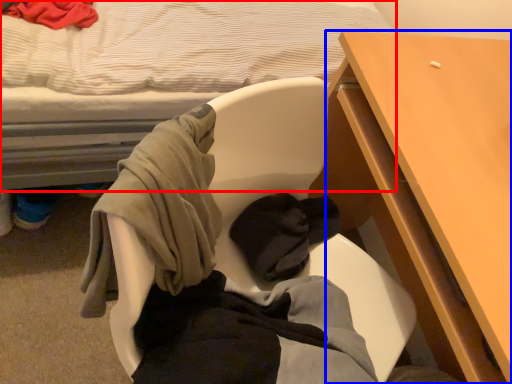
Question: Which object appears closest to the camera in this image, bed (highlighted by a red box) or desk (highlighted by a blue box)?

Choices:
 (A) bed
 (B) desk

Answer: (A)